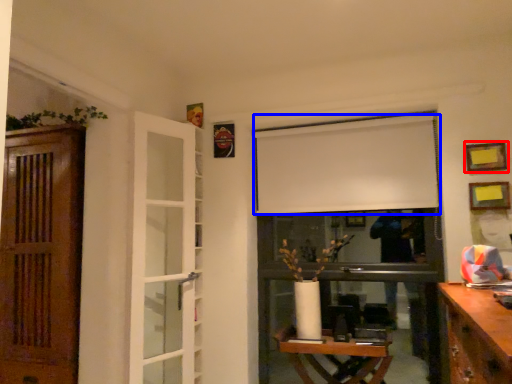
Question: Which point is further to the camera, picture frame (highlighted by a red box) or curtain (highlighted by a blue box)?

Choices:
 (A) picture frame
 (B) curtain

Answer: (B)